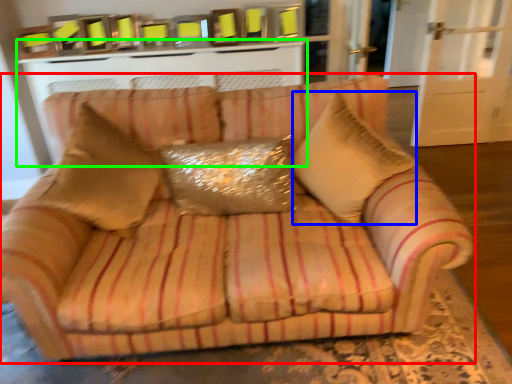
Question: Based on their relative distances, which object is farther from studio couch (highlighted by a red box)? Choose from throw pillow (highlighted by a blue box) and table (highlighted by a green box).

Choices:
 (A) throw pillow
 (B) table

Answer: (B)